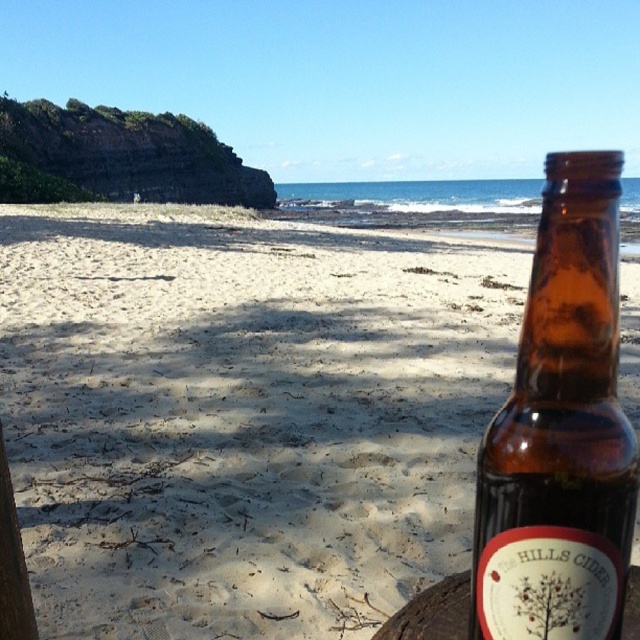
Does sandytexture at lower left have a lesser width compared to brown glass bottle at right?

No, sandytexture at lower left is not thinner than brown glass bottle at right.

Identify the location of sandytexture at lower left. The height and width of the screenshot is (640, 640). (243, 416).